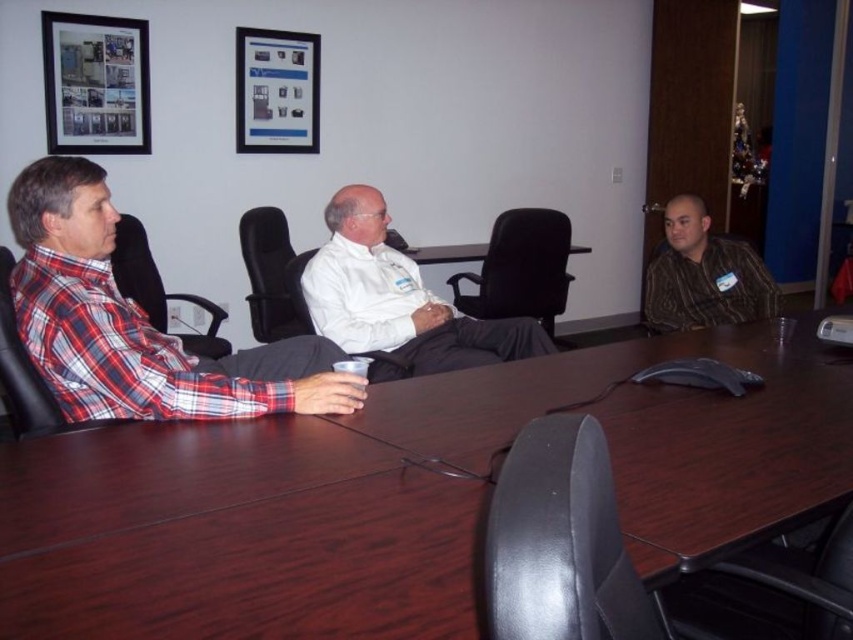
How far apart are plaid fabric shirt at left and matte black picture frame at upper center?

The distance of plaid fabric shirt at left from matte black picture frame at upper center is 8.00 feet.

Is point (164, 390) positioned after point (291, 92)?

No, it is not.

Identify the location of plaid fabric shirt at left. (136, 323).

Can you confirm if brown wood table at center is taller than matte black picture frame at upper center?

No.

Based on the photo, is brown wood table at center wider than matte black picture frame at upper center?

Yes.

Between point (437, 627) and point (289, 45), which one is positioned in front?

Point (437, 627) is in front.

Locate an element on the screen. brown wood table at center is located at coordinates (401, 496).

Between white matte shirt at center and matte black picture frame at upper center, which one has more height?

white matte shirt at center is taller.

How much distance is there between white matte shirt at center and matte black picture frame at upper center?

They are 1.57 meters apart.

Is point (396, 352) in front of point (299, 65)?

That is True.

Locate an element on the screen. white matte shirt at center is located at coordinates (397, 300).